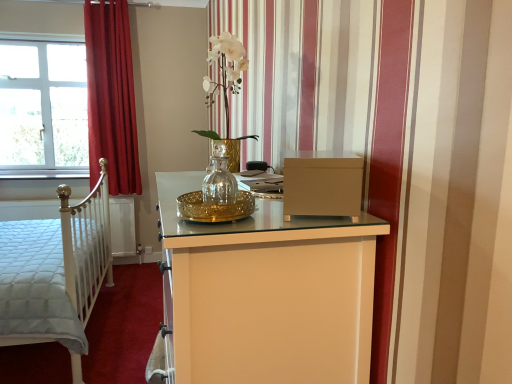
Locate an element on the screen. Image resolution: width=512 pixels, height=384 pixels. red velvet curtain at left is located at coordinates (111, 96).

This screenshot has width=512, height=384. What are the coordinates of `matte brown file cabinet at center` in the screenshot? It's located at (322, 184).

In order to face clear glass vase at center, should I rotate leftwards or rightwards?

You should rotate left by 2.600 degrees.

Where is `red velvet curtain at left`? The width and height of the screenshot is (512, 384). red velvet curtain at left is located at coordinates (111, 96).

Considering the relative sizes of white quilted fabric bed at left and clear glass vase at center in the image provided, is white quilted fabric bed at left taller than clear glass vase at center?

Correct, white quilted fabric bed at left is much taller as clear glass vase at center.

Between white quilted fabric bed at left and clear glass vase at center, which one has smaller width?

clear glass vase at center is thinner.

Is clear glass vase at center surrounded by white quilted fabric bed at left?

Actually, clear glass vase at center is outside white quilted fabric bed at left.

Is white quilted fabric bed at left turned away from clear glass vase at center?

No, clear glass vase at center is not at the back of white quilted fabric bed at left.

Considering the sizes of matte brown file cabinet at center and white glass window at upper left in the image, is matte brown file cabinet at center taller or shorter than white glass window at upper left?

Clearly, matte brown file cabinet at center is shorter compared to white glass window at upper left.

From a real-world perspective, is matte brown file cabinet at center above or below white glass window at upper left?

matte brown file cabinet at center is situated lower than white glass window at upper left in the real world.

Is matte brown file cabinet at center bigger or smaller than white glass window at upper left?

In the image, matte brown file cabinet at center appears to be smaller than white glass window at upper left.

In the image, is matte brown file cabinet at center positioned in front of or behind white glass window at upper left?

Clearly, matte brown file cabinet at center is in front of white glass window at upper left.

In the scene shown: Is white quilted fabric bed at left looking in the opposite direction of red velvet curtain at left?

No, white quilted fabric bed at left's orientation is not away from red velvet curtain at left.

From a real-world perspective, does white quilted fabric bed at left sit lower than red velvet curtain at left?

Yes.

Which object is positioned more to the right, white quilted fabric bed at left or red velvet curtain at left?

Positioned to the right is red velvet curtain at left.

The height and width of the screenshot is (384, 512). Find the location of `curtain that is above the white quilted fabric bed at left (from a real-world perspective)`. curtain that is above the white quilted fabric bed at left (from a real-world perspective) is located at coordinates (111, 96).

From the image's perspective, which object appears higher, red velvet curtain at left or white glass window at upper left?

red velvet curtain at left.

You are a GUI agent. You are given a task and a screenshot of the screen. Output one action in this format:
    pyautogui.click(x=<x>, y=<y>)
    Task: Click on the window on the left side of red velvet curtain at left
    
    Given the screenshot: What is the action you would take?
    pyautogui.click(x=42, y=110)

From a real-world perspective, is red velvet curtain at left physically located above or below white glass window at upper left?

In terms of real-world spatial position, red velvet curtain at left is above white glass window at upper left.

What's the angular difference between red velvet curtain at left and white glass window at upper left's facing directions?

They differ by 1.38 degrees in their facing directions.

From the picture: Considering the positions of objects white glass window at upper left and matte brown file cabinet at center in the image provided, who is more to the left, white glass window at upper left or matte brown file cabinet at center?

white glass window at upper left is more to the left.

Looking at this image, which is correct: white glass window at upper left is inside matte brown file cabinet at center, or outside of it?

white glass window at upper left is not enclosed by matte brown file cabinet at center.

What's the angular difference between white glass window at upper left and matte brown file cabinet at center's facing directions?

The angle between the facing direction of white glass window at upper left and the facing direction of matte brown file cabinet at center is 104 degrees.

Image resolution: width=512 pixels, height=384 pixels. I want to click on window that appears above the matte brown file cabinet at center (from a real-world perspective), so click(42, 110).

Could you tell me if white glass window at upper left is turned towards clear glass vase at center?

No.

Looking at this image, from a real-world perspective, which is physically below, white glass window at upper left or clear glass vase at center?

From a 3D spatial view, clear glass vase at center is below.

Consider the image. Do you think white glass window at upper left is within clear glass vase at center, or outside of it?

white glass window at upper left is not inside clear glass vase at center, it's outside.

Are white glass window at upper left and clear glass vase at center located far from each other?

Yes, white glass window at upper left and clear glass vase at center are located far from each other.

The height and width of the screenshot is (384, 512). Identify the location of file cabinet above the white quilted fabric bed at left (from the image's perspective). point(322,184).

Considering the relative positions of matte brown file cabinet at center and white quilted fabric bed at left in the image provided, is matte brown file cabinet at center to the left or to the right of white quilted fabric bed at left?

matte brown file cabinet at center is to the right of white quilted fabric bed at left.

Which of these two, matte brown file cabinet at center or white quilted fabric bed at left, is smaller?

matte brown file cabinet at center is smaller.

What's the angular difference between matte brown file cabinet at center and white quilted fabric bed at left's facing directions?

There is a 164-degree angle between the facing directions of matte brown file cabinet at center and white quilted fabric bed at left.

Where is `floral arrangement that is on the right side of white quilted fabric bed at left`? The width and height of the screenshot is (512, 384). floral arrangement that is on the right side of white quilted fabric bed at left is located at coordinates (226, 90).

Identify the location of window that is on the left side of matte brown file cabinet at center. Image resolution: width=512 pixels, height=384 pixels. (42, 110).

Based on their spatial positions, is matte brown file cabinet at center or red velvet curtain at left further from white quilted fabric bed at left?

Among the two, matte brown file cabinet at center is located further to white quilted fabric bed at left.

Looking at the image, which one is located closer to red velvet curtain at left, matte brown file cabinet at center or white glass window at upper left?

Among the two, white glass window at upper left is located nearer to red velvet curtain at left.

Looking at this image, looking at the image, which one is located further to white quilted fabric bed at left, matte brown file cabinet at center or white glass window at upper left?

matte brown file cabinet at center.

Based on their spatial positions, is white glass window at upper left or matte brown file cabinet at center closer to clear glass vase at center?

Based on the image, matte brown file cabinet at center appears to be nearer to clear glass vase at center.

From the image, which object appears to be farther from red velvet curtain at left, white quilted fabric bed at left or white glass window at upper left?

white quilted fabric bed at left lies further to red velvet curtain at left than the other object.

From the image, which object appears to be farther from matte brown file cabinet at center, white quilted fabric bed at left or red velvet curtain at left?

Based on the image, red velvet curtain at left appears to be further to matte brown file cabinet at center.

Based on their spatial positions, is white glass window at upper left or clear glass vase at center closer to red velvet curtain at left?

white glass window at upper left.

Based on their spatial positions, is white glass window at upper left or red velvet curtain at left closer to clear glass vase at center?

The object closer to clear glass vase at center is red velvet curtain at left.

The image size is (512, 384). In order to click on bed positioned between clear glass vase at center and red velvet curtain at left from near to far in this screenshot , I will do `click(66, 279)`.

Locate an element on the screen. curtain between matte brown file cabinet at center and white glass window at upper left from front to back is located at coordinates (111, 96).

This screenshot has height=384, width=512. Identify the location of floral arrangement between matte brown file cabinet at center and white glass window at upper left along the z-axis. (226, 90).

What are the coordinates of `bed between matte brown file cabinet at center and white glass window at upper left from front to back` in the screenshot? It's located at (66, 279).